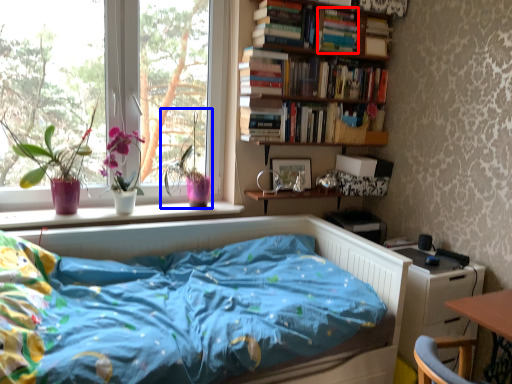
Question: Which of the following is the farthest to the observer, book (highlighted by a red box) or floral arrangement (highlighted by a blue box)?

Choices:
 (A) book
 (B) floral arrangement

Answer: (A)